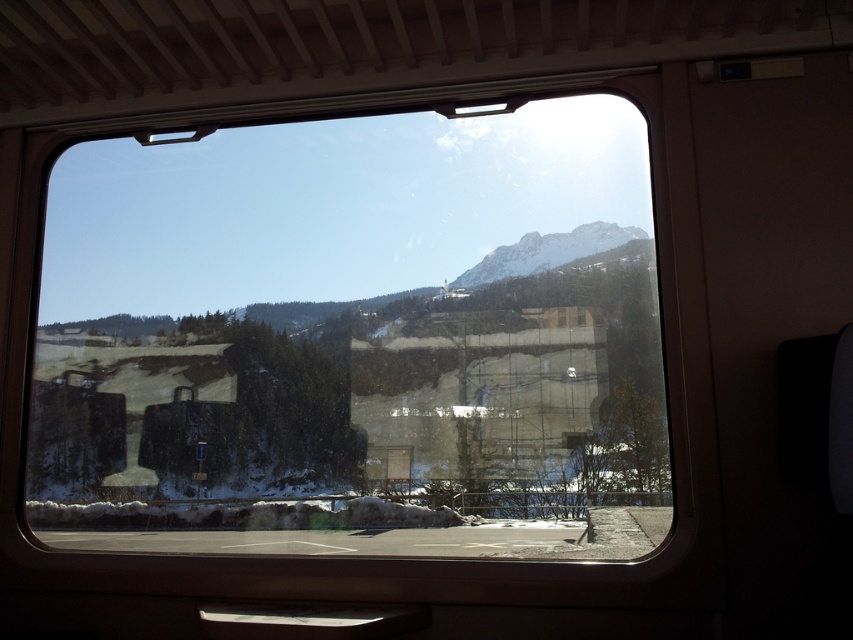
You are a passenger sitting in the train and want to take a photo of the snowy rocky mountain at upper center through the transparent glass train window at center. Can you do that without any obstruction?

The transparent glass train window at center is located below the snowy rocky mountain at upper center, so you can take the photo without obstruction as the window is positioned directly beneath the mountain, allowing an unobstructed view.

You are a passenger sitting in the train and want to take a photo of the snow covered mountains in the distance through the transparent glass train window at center. Will the window be in the center of your photo?

The transparent glass train window at center is located at point (355, 339) which is very close to the center of the photo, so the window will be in the center of your photo.